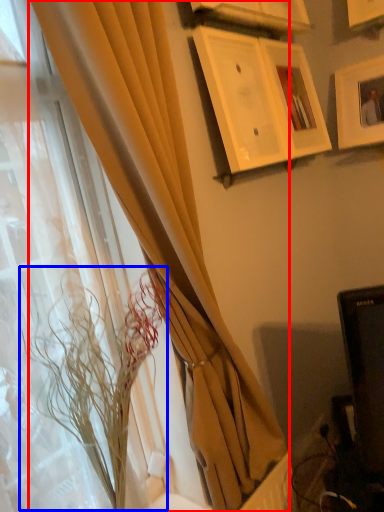
Question: Which of the following is the farthest to the observer, curtain (highlighted by a red box) or flower (highlighted by a blue box)?

Choices:
 (A) curtain
 (B) flower

Answer: (B)